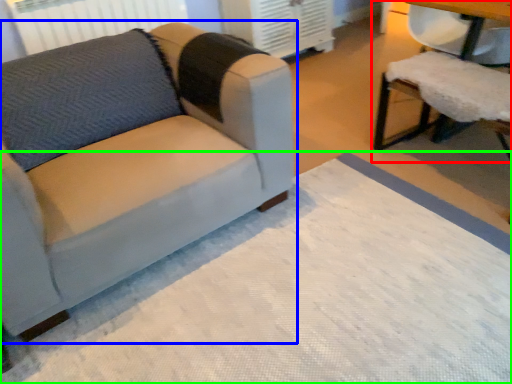
Question: Which object is the closest to the chair (highlighted by a red box)? Choose among these: studio couch (highlighted by a blue box) or mat (highlighted by a green box).

Choices:
 (A) studio couch
 (B) mat

Answer: (B)